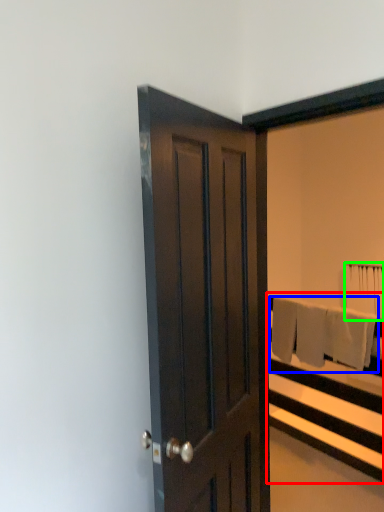
Question: Which object is positioned farthest from bed frame (highlighted by a red box)? Select from bath towel (highlighted by a blue box) and bath towel (highlighted by a green box).

Choices:
 (A) bath towel
 (B) bath towel

Answer: (B)